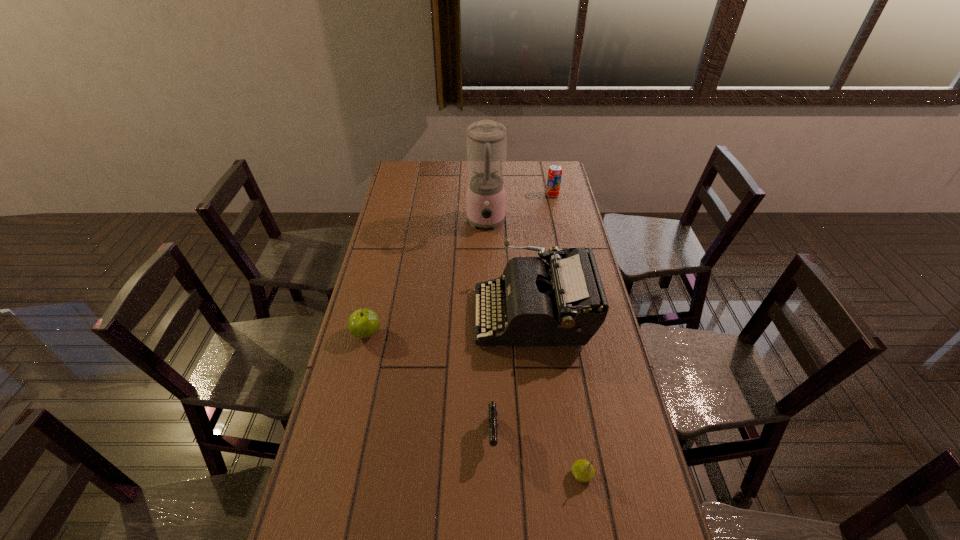
The width and height of the screenshot is (960, 540). I want to click on free space located 0.170m on the front-facing side of the fifth shortest object, so click(x=426, y=315).

Where is `vacant space located on the front-facing side of the fifth shortest object`? vacant space located on the front-facing side of the fifth shortest object is located at coordinates (390, 315).

Locate an element on the screen. The height and width of the screenshot is (540, 960). vacant region located on the front-facing side of the fifth shortest object is located at coordinates (378, 315).

I want to click on vacant space situated on the back of the fourth shortest object, so click(546, 167).

Where is `vacant space located 0.400m on the back of the third shortest object`? Image resolution: width=960 pixels, height=540 pixels. vacant space located 0.400m on the back of the third shortest object is located at coordinates (387, 249).

Find the location of a particular element. The image size is (960, 540). free location located at the barrel of the fifth farthest object is located at coordinates (495, 532).

I want to click on vacant region located 0.230m on the back of the nearest object, so click(x=567, y=389).

Identify the location of object present at the left edge. (363, 323).

I want to click on typewriter present at the right edge, so (564, 303).

Where is `soda can that is at the right edge`? This screenshot has height=540, width=960. soda can that is at the right edge is located at coordinates (555, 171).